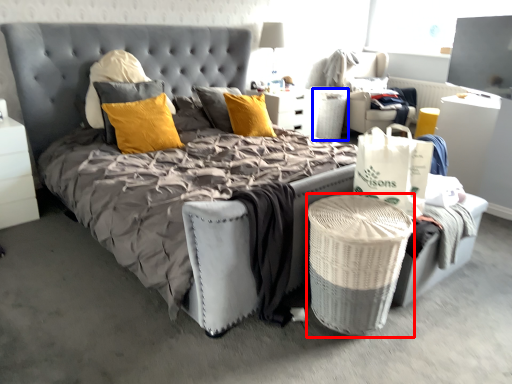
Question: Which object is further to the camera taking this photo, laundry basket (highlighted by a red box) or basket (highlighted by a blue box)?

Choices:
 (A) laundry basket
 (B) basket

Answer: (B)